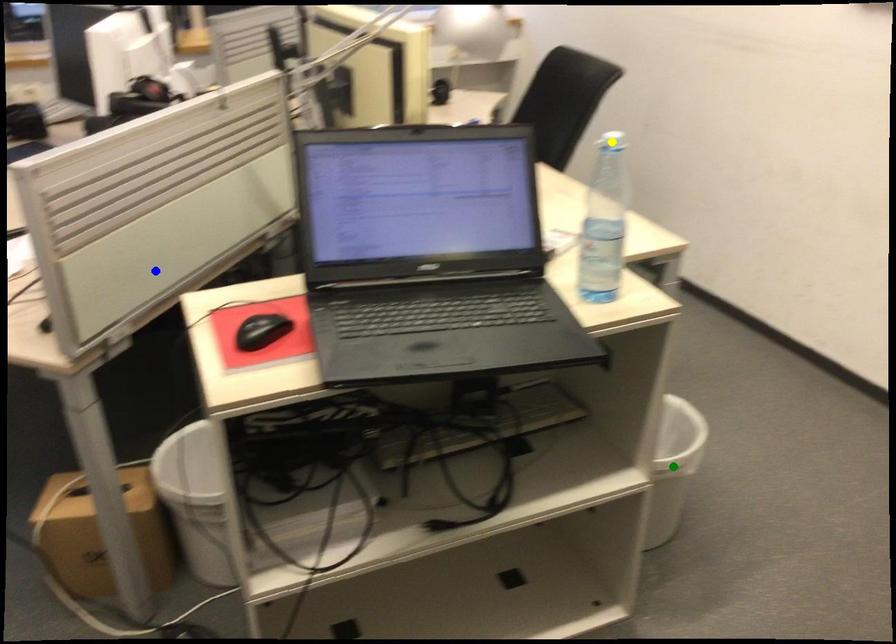
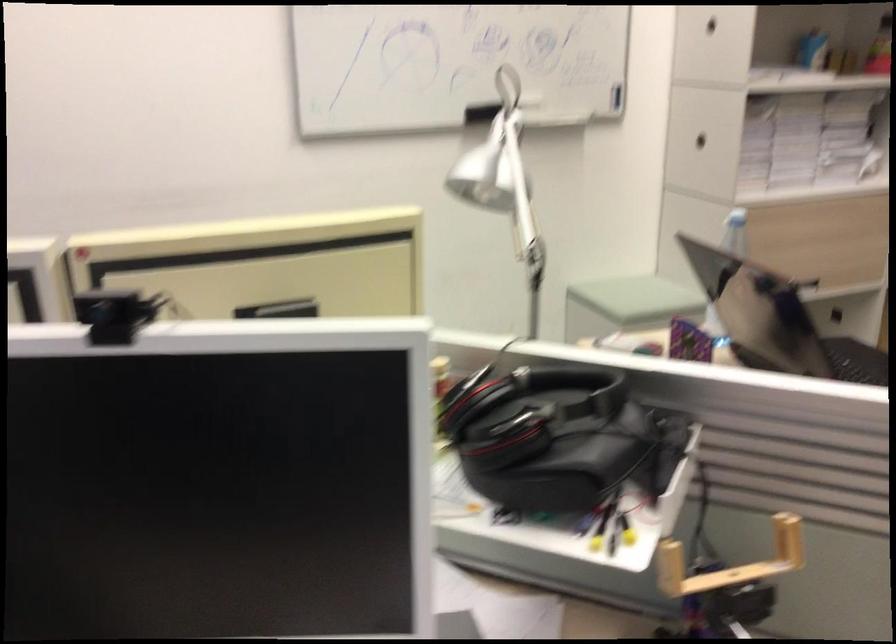
I am providing you with two images of the same scene from different viewpoints. Three points are marked in image1. Which point corresponds to a part or object that is occluded in image2?In image1, three points are marked. Which of them correspond to a part or object that is occluded in image2?Among the three points shown in image1, which one corresponds to a part or object that is no longer visible due to occlusion in image2?

Invisible in image2: yellow point, green point.